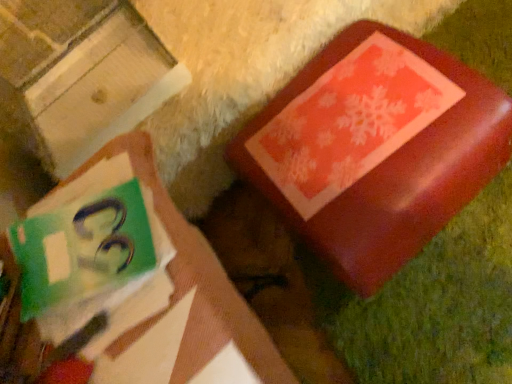
Question: Does matte green book at upper left have a lesser height compared to shiny red box at upper right?

Choices:
 (A) no
 (B) yes

Answer: (A)

Question: Does matte green book at upper left have a greater height compared to shiny red box at upper right?

Choices:
 (A) no
 (B) yes

Answer: (B)

Question: Is matte green book at upper left positioned beyond the bounds of shiny red box at upper right?

Choices:
 (A) yes
 (B) no

Answer: (A)

Question: From the image's perspective, would you say matte green book at upper left is shown under shiny red box at upper right?

Choices:
 (A) yes
 (B) no

Answer: (A)

Question: Considering the relative sizes of matte green book at upper left and shiny red box at upper right in the image provided, is matte green book at upper left wider than shiny red box at upper right?

Choices:
 (A) no
 (B) yes

Answer: (A)

Question: Choose the correct answer: Is matte red box at upper right inside shiny red box at upper right or outside it?

Choices:
 (A) inside
 (B) outside

Answer: (B)

Question: From the image's perspective, is matte red box at upper right located above or below shiny red box at upper right?

Choices:
 (A) below
 (B) above

Answer: (B)

Question: Looking at the image, does matte red box at upper right seem bigger or smaller compared to shiny red box at upper right?

Choices:
 (A) big
 (B) small

Answer: (B)

Question: Looking at their shapes, would you say matte red box at upper right is wider or thinner than shiny red box at upper right?

Choices:
 (A) thin
 (B) wide

Answer: (B)

Question: Is shiny red box at upper right spatially inside matte green book at upper left, or outside of it?

Choices:
 (A) inside
 (B) outside

Answer: (B)

Question: Is shiny red box at upper right bigger or smaller than matte green book at upper left?

Choices:
 (A) small
 (B) big

Answer: (A)

Question: Considering the positions of shiny red box at upper right and matte green book at upper left in the image, is shiny red box at upper right wider or thinner than matte green book at upper left?

Choices:
 (A) wide
 (B) thin

Answer: (A)

Question: In terms of height, does shiny red box at upper right look taller or shorter compared to matte green book at upper left?

Choices:
 (A) short
 (B) tall

Answer: (A)

Question: Considering the positions of shiny red box at upper right and matte red box at upper right in the image, is shiny red box at upper right wider or thinner than matte red box at upper right?

Choices:
 (A) thin
 (B) wide

Answer: (A)

Question: Is point (270, 160) closer or farther from the camera than point (66, 8)?

Choices:
 (A) farther
 (B) closer

Answer: (B)